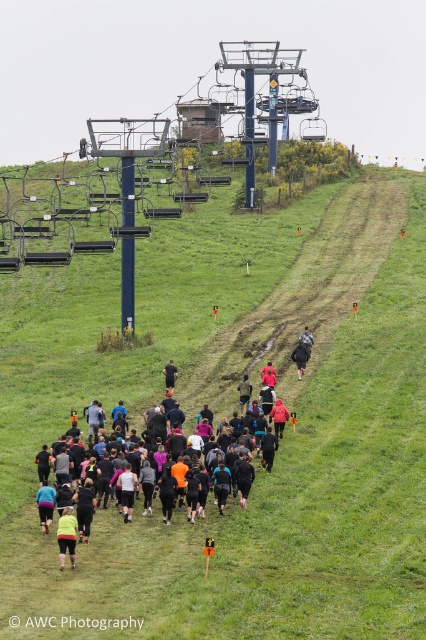
Question: Among these objects, which one is nearest to the camera?

Choices:
 (A) green grassy hillside at center
 (B) black fabric person at center
 (C) black fabric runner at center
 (D) camouflage fabric jacket at center

Answer: (A)

Question: Can you confirm if orange fabric jacket at center is smaller than black matte jacket at center?

Choices:
 (A) no
 (B) yes

Answer: (B)

Question: Which point is farther to the camera?

Choices:
 (A) black fabric jacket at center
 (B) camouflage fabric jacket at center
 (C) green grassy hillside at center
 (D) black fabric person at center

Answer: (B)

Question: Among these objects, which one is nearest to the camera?

Choices:
 (A) orange fabric jacket at center
 (B) black matte jacket at center

Answer: (A)

Question: Is black fabric running suit at center thinner than black fabric jacket at center?

Choices:
 (A) no
 (B) yes

Answer: (B)

Question: Does green grassy hillside at center have a greater width compared to black matte jacket at center?

Choices:
 (A) yes
 (B) no

Answer: (A)